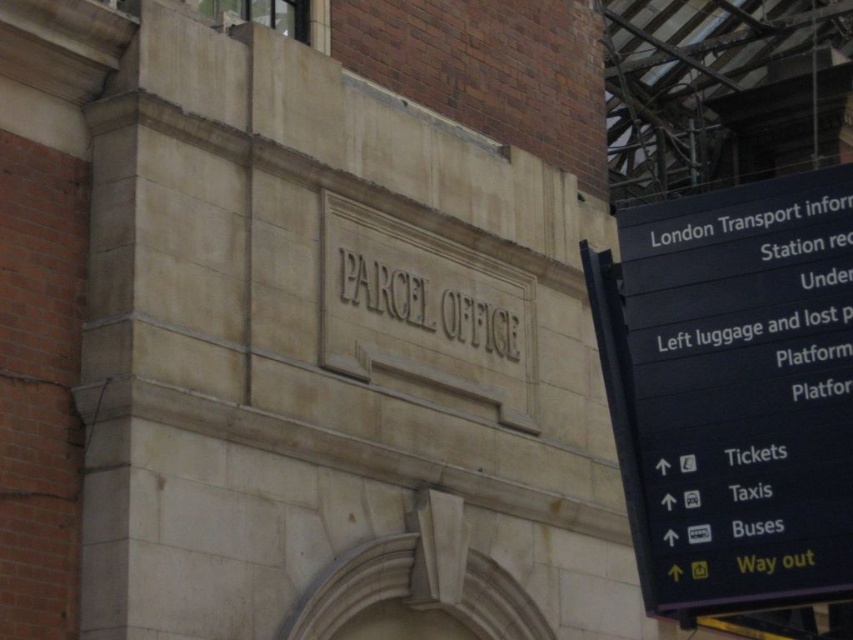
From the picture: Is black plastic sign at right positioned in front of matte stone sign at center?

That is True.

Can you confirm if black plastic sign at right is bigger than matte stone sign at center?

Indeed, black plastic sign at right has a larger size compared to matte stone sign at center.

Which is behind, point (738, 275) or point (451, 332)?

Point (451, 332)

Find the location of a particular element. This screenshot has height=640, width=853. black plastic sign at right is located at coordinates (738, 394).